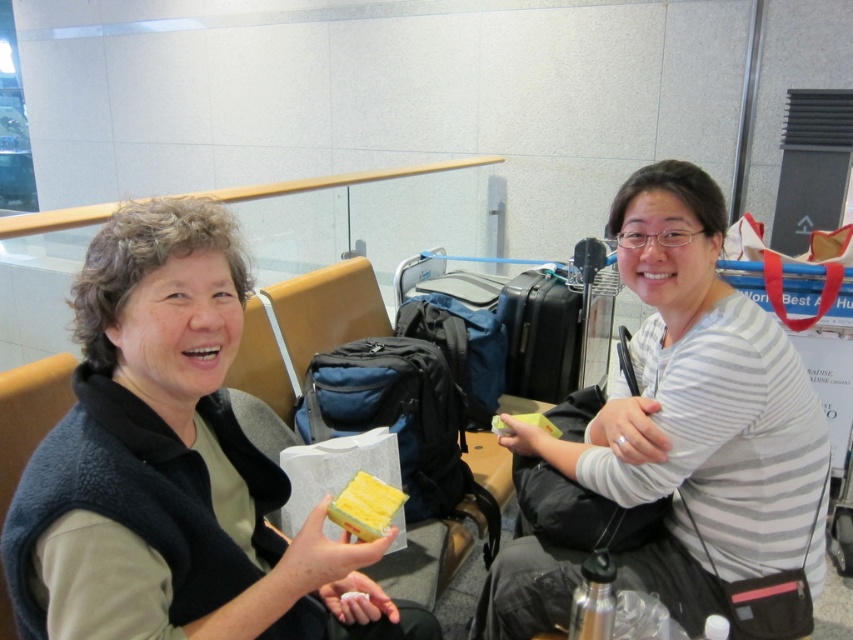
You are a delivery robot in an airport terminal. You need to deliver a package to the person wearing the matte black vest at left. However, there is a black fabric backpack at right in your path. Can you navigate around the backpack to reach the person? The robot has a turning radius of 24 inches.

The distance between the matte black vest at left and the black fabric backpack at right is 22.89 inches. Since the robot requires a turning radius of 24 inches, it cannot navigate around the backpack and will need to find an alternative path to reach the person wearing the matte black vest at left.

You are a service robot in an airport. You need to deliver a small package to the person wearing the matte black vest at left. The package is 30 inches long. Can you reach them without extending your arm beyond your maximum reach of 30 inches?

The distance between the matte black vest at left and the viewer is 29.83 inches. Since the package is 30 inches long and your maximum reach is 30 inches, you can just barely reach them with the package.